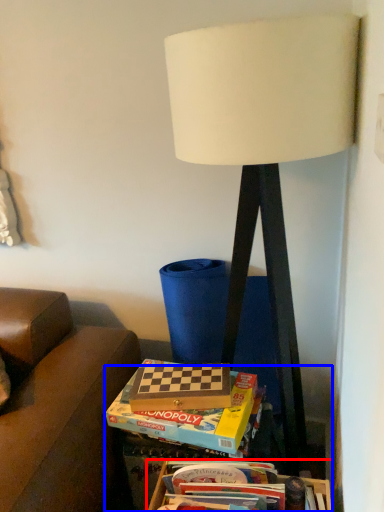
Question: Which of the following is the closest to the observer, box (highlighted by a red box) or table (highlighted by a blue box)?

Choices:
 (A) box
 (B) table

Answer: (A)